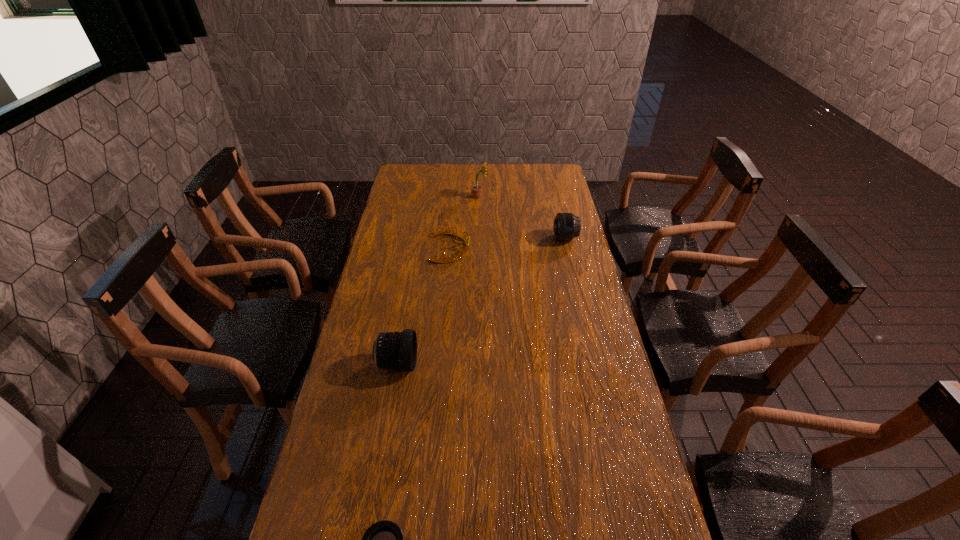
Where is `vacant space positioned 0.270m on the front-facing side of the farthest telephoto lens`? The height and width of the screenshot is (540, 960). vacant space positioned 0.270m on the front-facing side of the farthest telephoto lens is located at coordinates (491, 238).

This screenshot has width=960, height=540. Identify the location of vacant space positioned 0.400m on the front-facing side of the fourth tallest object. tap(567, 248).

Where is `object that is at the left edge`? The image size is (960, 540). object that is at the left edge is located at coordinates (396, 350).

I want to click on object situated at the right edge, so click(x=566, y=227).

This screenshot has height=540, width=960. Find the location of `free space at the left edge of the desktop`. free space at the left edge of the desktop is located at coordinates (398, 245).

The height and width of the screenshot is (540, 960). I want to click on vacant space at the right edge, so click(x=638, y=448).

Where is `free space at the far left corner of the desktop`? free space at the far left corner of the desktop is located at coordinates (412, 176).

The width and height of the screenshot is (960, 540). I want to click on free space at the far right corner of the desktop, so click(549, 178).

Find the location of a particular element. Image resolution: width=960 pixels, height=540 pixels. free space between the rightmost object and the farthest object is located at coordinates (x=522, y=217).

You are a GUI agent. You are given a task and a screenshot of the screen. Output one action in this format:
    pyautogui.click(x=<x>, y=<y>)
    Task: Click on the free space that is in between the rightmost telephoto lens and the second nearest telephoto lens
    The image size is (960, 540).
    Given the screenshot: What is the action you would take?
    pyautogui.click(x=481, y=301)